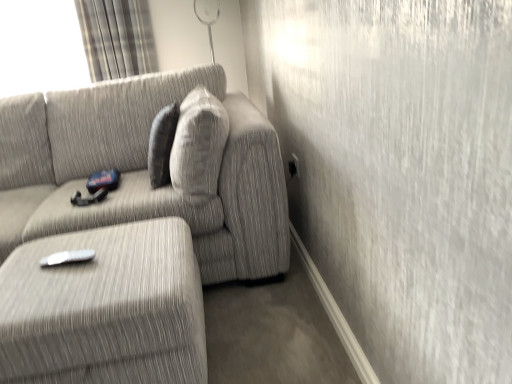
Question: Can you confirm if white plastic remote at lower left is wider than textured gray couch at center?

Choices:
 (A) yes
 (B) no

Answer: (B)

Question: Does white plastic remote at lower left have a lesser height compared to textured gray couch at center?

Choices:
 (A) no
 (B) yes

Answer: (B)

Question: Is the depth of white plastic remote at lower left less than that of textured gray couch at center?

Choices:
 (A) yes
 (B) no

Answer: (A)

Question: Can you confirm if white plastic remote at lower left is smaller than textured gray couch at center?

Choices:
 (A) yes
 (B) no

Answer: (A)

Question: Does white plastic remote at lower left have a greater height compared to textured gray couch at center?

Choices:
 (A) no
 (B) yes

Answer: (A)

Question: Are white plastic remote at lower left and textured gray couch at center far apart?

Choices:
 (A) yes
 (B) no

Answer: (B)

Question: Does textured gray ottoman at lower left appear on the left side of white plastic remote at lower left?

Choices:
 (A) yes
 (B) no

Answer: (B)

Question: From the image's perspective, is textured gray ottoman at lower left located above white plastic remote at lower left?

Choices:
 (A) no
 (B) yes

Answer: (A)

Question: Considering the relative sizes of textured gray ottoman at lower left and white plastic remote at lower left in the image provided, is textured gray ottoman at lower left bigger than white plastic remote at lower left?

Choices:
 (A) yes
 (B) no

Answer: (A)

Question: Considering the relative sizes of textured gray ottoman at lower left and white plastic remote at lower left in the image provided, is textured gray ottoman at lower left smaller than white plastic remote at lower left?

Choices:
 (A) no
 (B) yes

Answer: (A)

Question: Is textured gray ottoman at lower left positioned far away from white plastic remote at lower left?

Choices:
 (A) no
 (B) yes

Answer: (A)

Question: From a real-world perspective, is textured gray ottoman at lower left physically below white plastic remote at lower left?

Choices:
 (A) yes
 (B) no

Answer: (A)

Question: Does white plastic remote at lower left have a greater width compared to plaid fabric curtain at upper left?

Choices:
 (A) no
 (B) yes

Answer: (A)